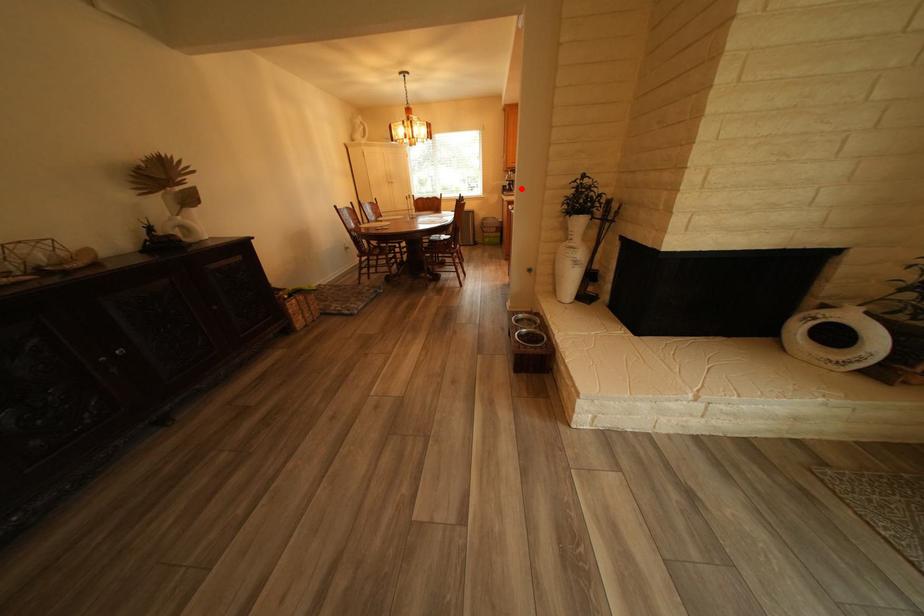
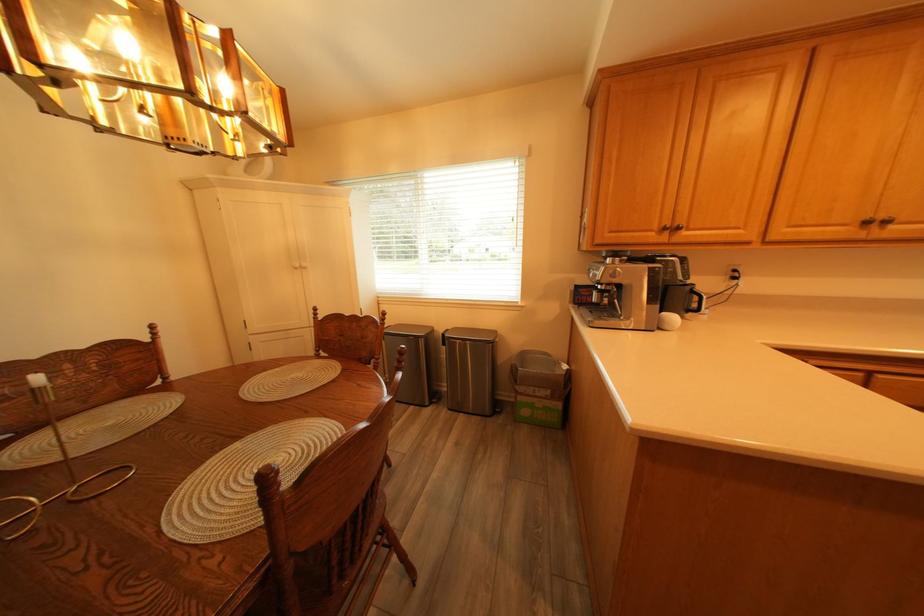
Question: I am providing you with two images of the same scene from different viewpoints. In image1, a red point is highlighted. Considering the same 3D point in image2, which of the following is correct?

Choices:
 (A) It is closer
 (B) It is farther

Answer: (B)